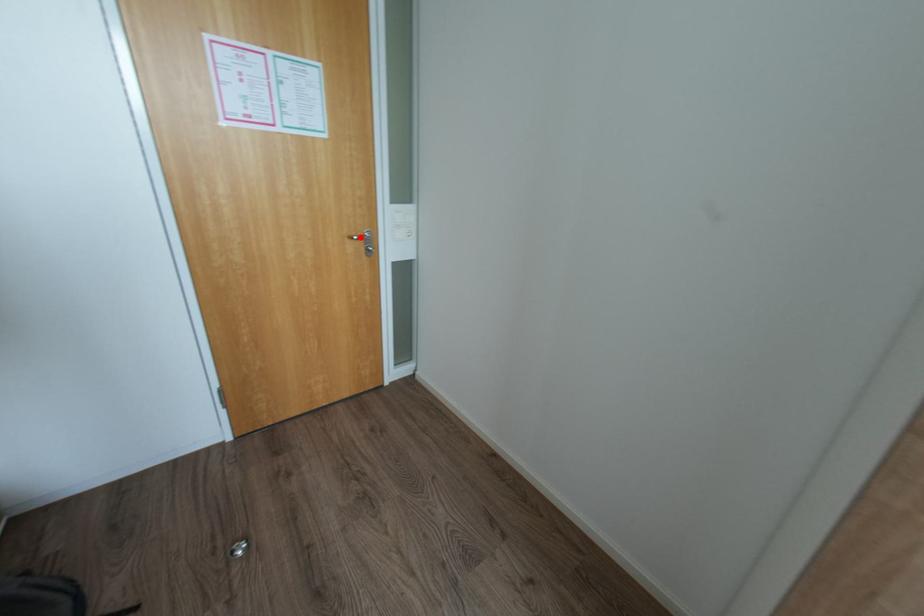
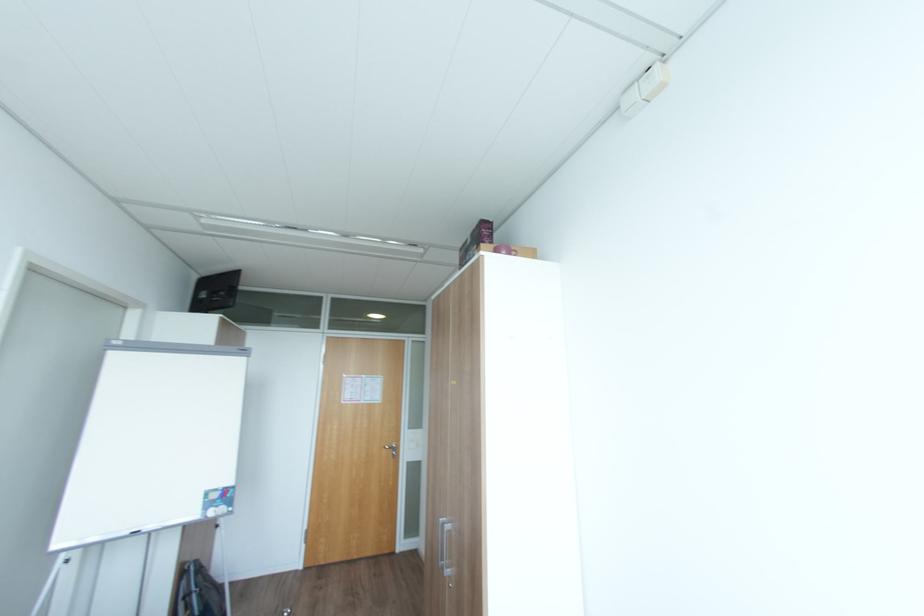
Question: I am providing you with two images of the same scene from different viewpoints. A red point is shown in image1. For the corresponding object point in image2, is it positioned nearer or farther from the camera?

Choices:
 (A) Nearer
 (B) Farther

Answer: (B)